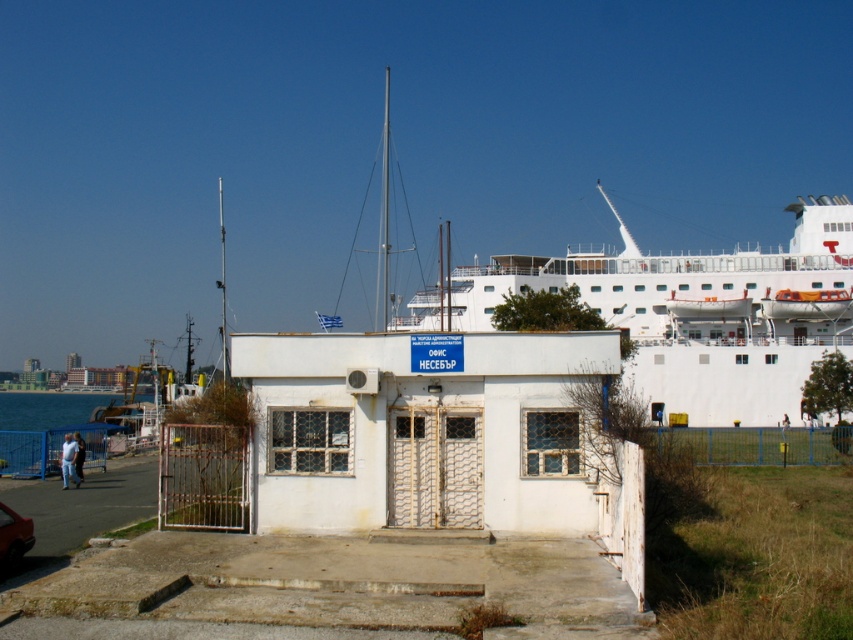
You are a photographer planning to take a wide shot of the white glossy ship at upper center and the shiny red car at lower left. Considering their sizes, which object should you position closer to the camera to ensure both appear roughly the same size in the photo?

Since the white glossy ship at upper center is wider than the shiny red car at lower left, you should position the shiny red car at lower left closer to the camera to balance their sizes in the photo.

You are standing in front of the white building and want to walk to the shiny red car at lower left. Which direction should you turn to face the blue water at lower left first before reaching the car?

Since the blue water at lower left is positioned on the left side of the shiny red car at lower left, you should turn to your left to face the blue water at lower left first before reaching the car.